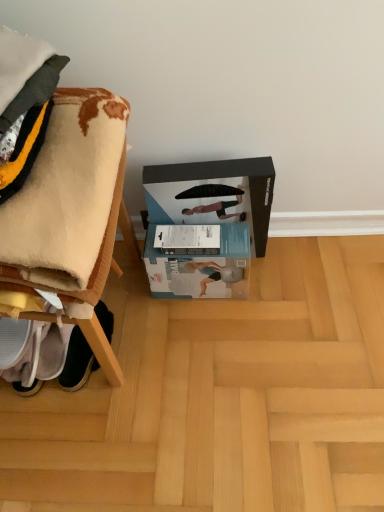
You are a GUI agent. You are given a task and a screenshot of the screen. Output one action in this format:
    pyautogui.click(x=<x>, y=<y>)
    Task: Click on the free location to the left of white cardboard box at center
    Image resolution: width=384 pixels, height=512 pixels.
    Given the screenshot: What is the action you would take?
    pyautogui.click(x=134, y=293)